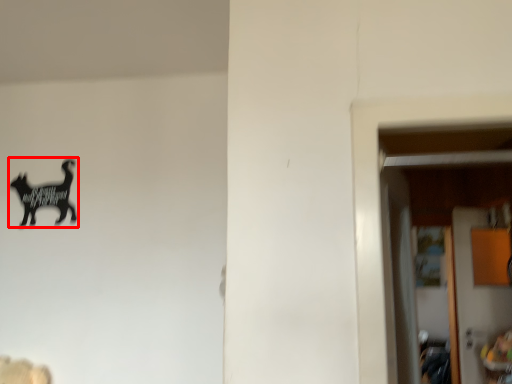
Question: From the image's perspective, where is animal (annotated by the red box) located in relation to door in the image?

Choices:
 (A) above
 (B) below

Answer: (A)